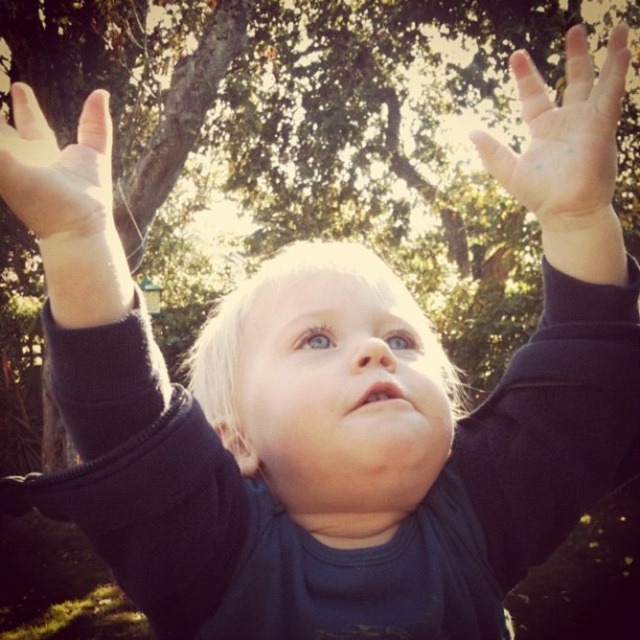
Does dark blue fabric at upper center appear under smooth skin palm at upper center?

Yes, dark blue fabric at upper center is below smooth skin palm at upper center.

Is point (518, 182) farther from camera compared to point (561, 218)?

No, it is in front of (561, 218).

The width and height of the screenshot is (640, 640). Find the location of `dark blue fabric at upper center`. dark blue fabric at upper center is located at coordinates (561, 320).

Who is more distant from viewer, (483,140) or (92,170)?

The point (483,140) is more distant.

Between dark blue fabric at upper center and smooth skin hand at upper left, which one has more height?

dark blue fabric at upper center is taller.

Measure the distance between point (538,552) and camera.

28.97 inches

Where is `dark blue fabric at upper center`? The image size is (640, 640). dark blue fabric at upper center is located at coordinates (561, 320).

Does matte black arm at upper left have a greater width compared to smooth skin hand at upper left?

In fact, matte black arm at upper left might be narrower than smooth skin hand at upper left.

Locate an element on the screen. This screenshot has height=640, width=640. matte black arm at upper left is located at coordinates (81, 268).